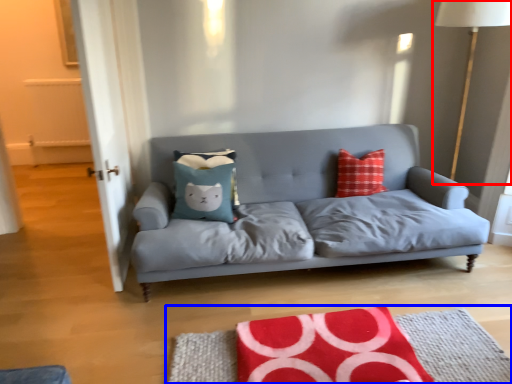
Question: Among these objects, which one is farthest to the camera, table lamp (highlighted by a red box) or mat (highlighted by a blue box)?

Choices:
 (A) table lamp
 (B) mat

Answer: (A)